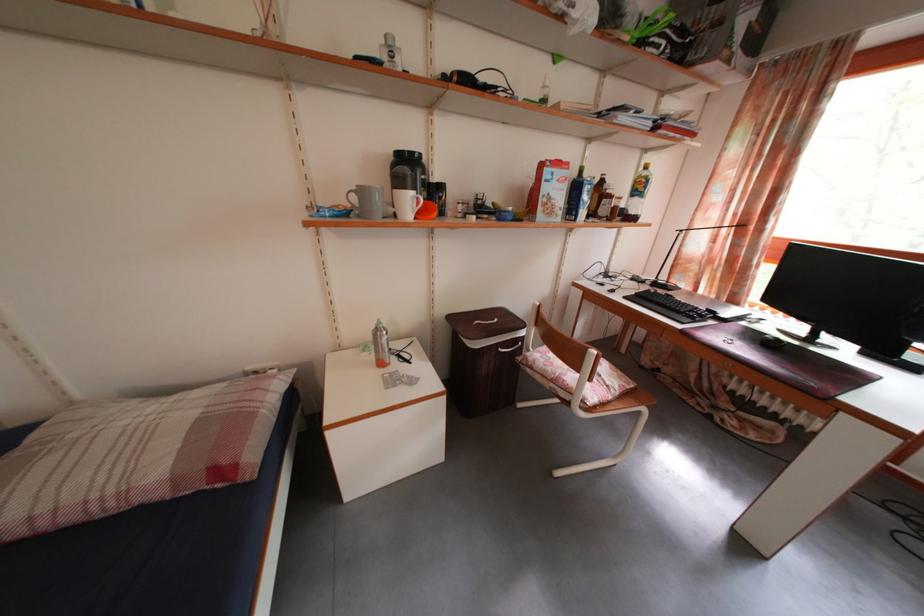
What do you see at coordinates (578, 377) in the screenshot? This screenshot has height=616, width=924. I see `the chair sitting surface` at bounding box center [578, 377].